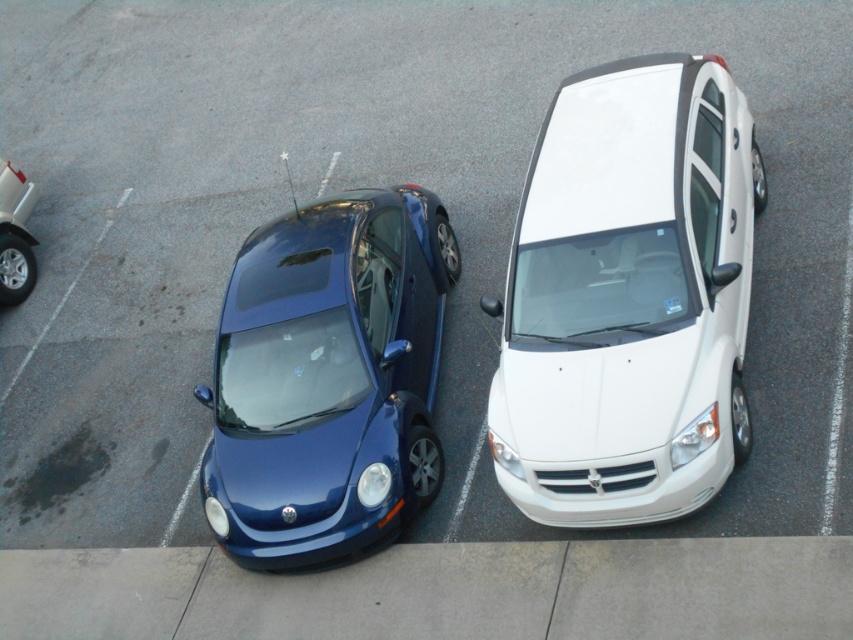
Question: Can you confirm if white glossy van at upper right is bigger than metallic blue car at center?

Choices:
 (A) no
 (B) yes

Answer: (B)

Question: Which of these objects is positioned closest to the white glossy van at upper right?

Choices:
 (A) metallic blue car at center
 (B) glossy blue car at center

Answer: (B)

Question: Which of the following is the closest to the observer?

Choices:
 (A) white glossy van at upper right
 (B) glossy blue car at center

Answer: (A)

Question: Considering the real-world distances, which object is closest to the metallic blue car at center?

Choices:
 (A) glossy blue car at center
 (B) white glossy van at upper right

Answer: (A)

Question: Does white glossy van at upper right have a greater width compared to glossy blue car at center?

Choices:
 (A) yes
 (B) no

Answer: (A)

Question: Where is white glossy van at upper right located in relation to glossy blue car at center in the image?

Choices:
 (A) above
 (B) below

Answer: (A)